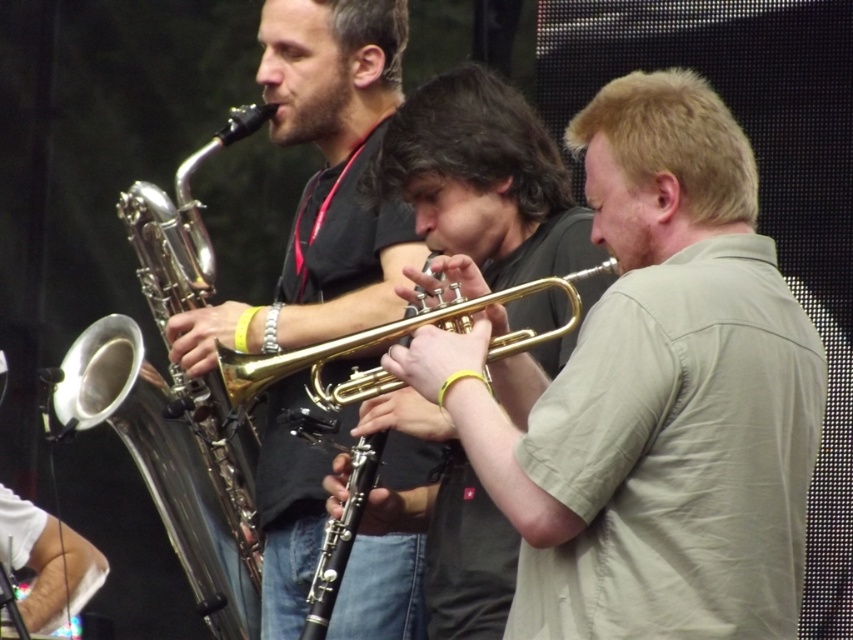
Question: Which point is closer to the camera?

Choices:
 (A) (292, 275)
 (B) (375, 326)

Answer: (B)

Question: Does shiny gold trumpet at left have a greater width compared to gold shiny trumpet at center?

Choices:
 (A) no
 (B) yes

Answer: (A)

Question: Which object is farther from the camera taking this photo?

Choices:
 (A) shiny brass saxophone at left
 (B) gold brass trumpet at center
 (C) gold shiny trumpet at center

Answer: (A)

Question: Among these points, which one is nearest to the camera?

Choices:
 (A) (386, 472)
 (B) (602, 452)

Answer: (B)

Question: From the image, what is the correct spatial relationship of gold brass trumpet at center in relation to shiny gold trumpet at left?

Choices:
 (A) above
 (B) below

Answer: (A)

Question: Does shiny gold trumpet at left have a greater width compared to gold shiny trumpet at center?

Choices:
 (A) yes
 (B) no

Answer: (B)